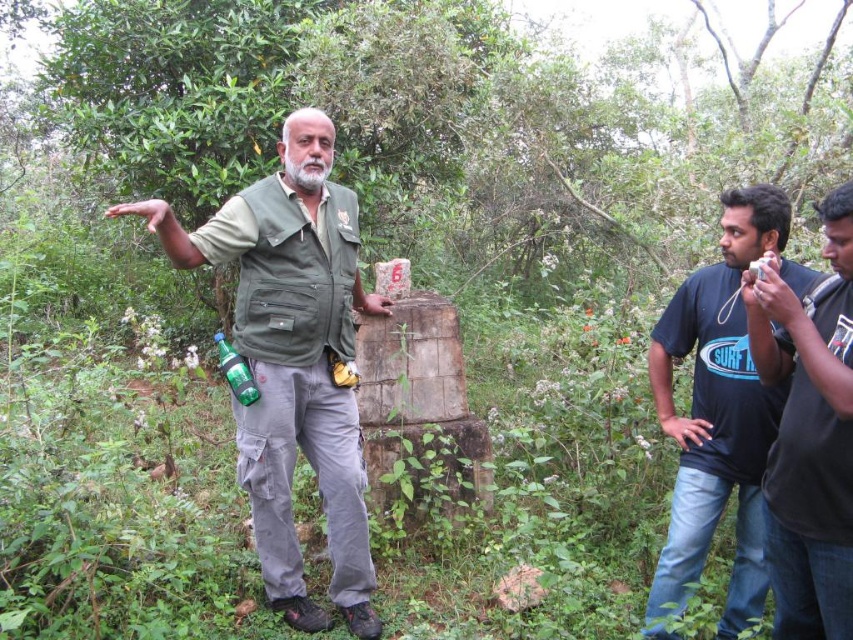
Can you confirm if blue cotton t-shirt at right is shorter than dark blue t-shirt at right?

No.

Who is more forward, (x=738, y=454) or (x=827, y=464)?

Point (x=827, y=464) is in front.

Image resolution: width=853 pixels, height=640 pixels. What are the coordinates of `blue cotton t-shirt at right` in the screenshot? It's located at 717,416.

Is dark blue t-shirt at right closer to the viewer compared to green glass bottle at center?

Yes, it is.

I want to click on dark blue t-shirt at right, so click(809, 435).

The image size is (853, 640). Identify the location of dark blue t-shirt at right. (809, 435).

Measure the distance between blue cotton t-shirt at right and camera.

8.76 feet

Is blue cotton t-shirt at right taller than green glass bottle at center?

Yes.

Is point (772, 234) positioned behind point (254, 390)?

No, (772, 234) is in front of (254, 390).

Locate an element on the screen. Image resolution: width=853 pixels, height=640 pixels. blue cotton t-shirt at right is located at coordinates (717, 416).